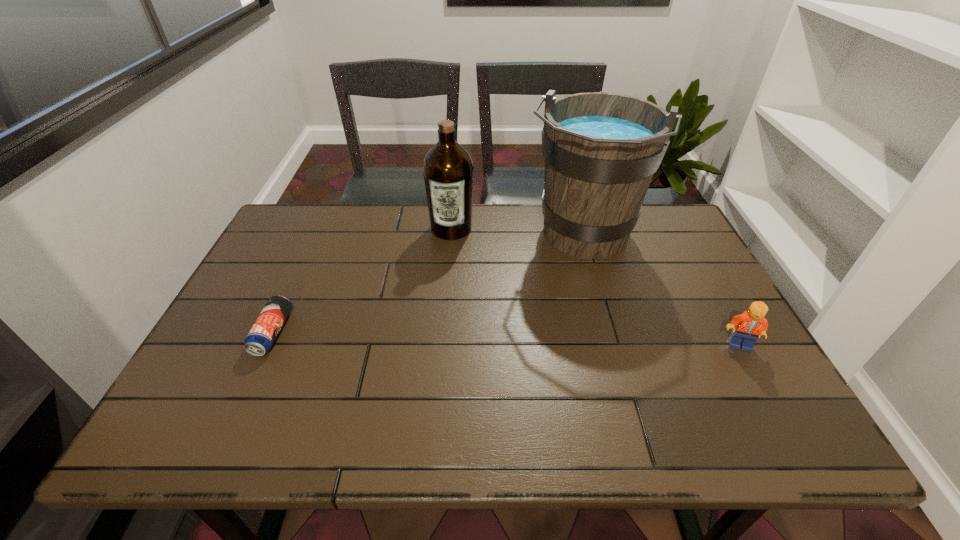
Where is `vacant space on the desktop that is between the leftmost object and the rightmost object and is positioned on the label of the third shortest object`? This screenshot has height=540, width=960. vacant space on the desktop that is between the leftmost object and the rightmost object and is positioned on the label of the third shortest object is located at coordinates (435, 337).

This screenshot has width=960, height=540. Find the location of `vacant space on the desktop that is between the leftmost object and the Lego and is positioned with a handle on the side of the tallest object`. vacant space on the desktop that is between the leftmost object and the Lego and is positioned with a handle on the side of the tallest object is located at coordinates (543, 340).